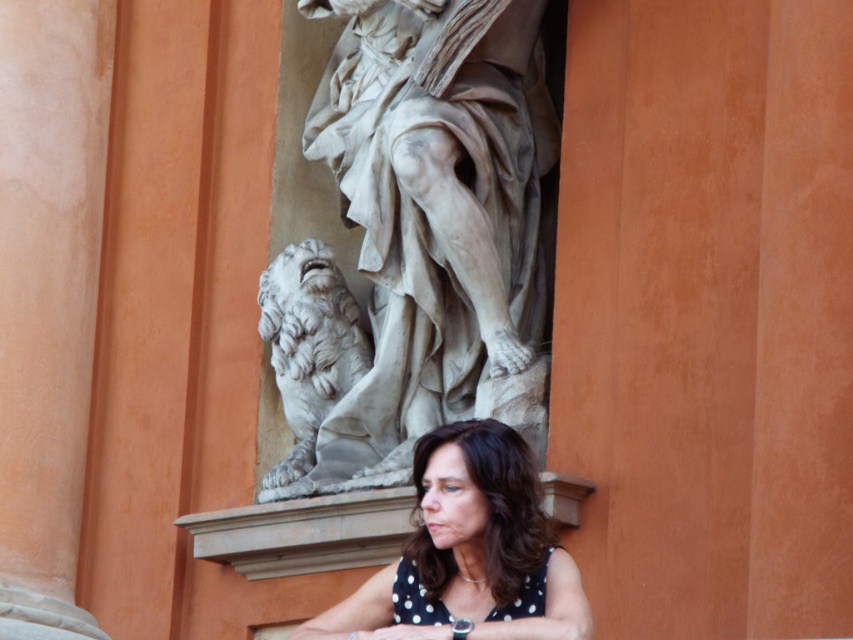
Question: Considering the relative positions of white marble statue at center and polka dot fabric at center in the image provided, where is white marble statue at center located with respect to polka dot fabric at center?

Choices:
 (A) above
 (B) below

Answer: (A)

Question: Which object is closer to the camera taking this photo?

Choices:
 (A) white marble statue at center
 (B) polka dot fabric at center

Answer: (B)

Question: Does white marble statue at center come in front of polka dot fabric at center?

Choices:
 (A) yes
 (B) no

Answer: (B)

Question: Is white marble statue at center wider than polka dot fabric at center?

Choices:
 (A) yes
 (B) no

Answer: (A)